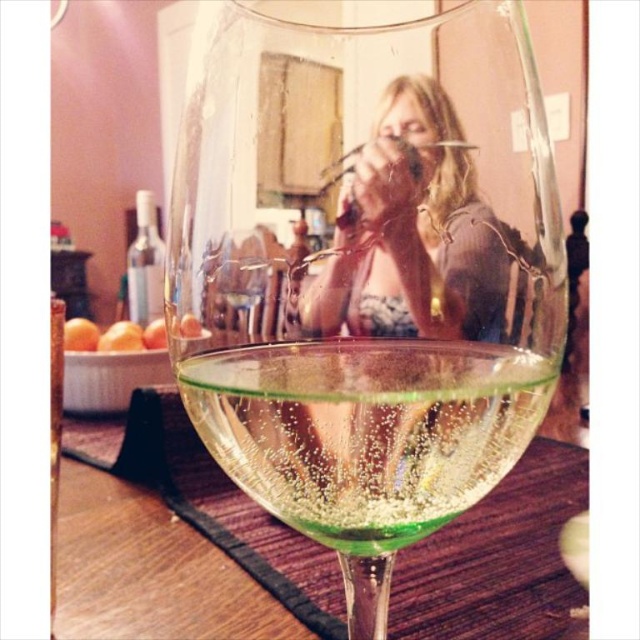
You are a bartender preparing a cocktail that requires precise measurements. You have a green translucent wine glass at center and green glass wine at center. Which object has a greater width?

The green translucent wine glass at center has a greater width than the green glass wine at center.

You are a photographer trying to capture the reflection of the woman in the green translucent wine glass at center. To do this, you need to position your camera directly above the glass. Based on the glass location coordinates, where should you place the camera relative to the image frame?

The green translucent wine glass at center is located at coordinates point [365,276], so you should position the camera directly above this point to capture the reflection of the woman in the glass.